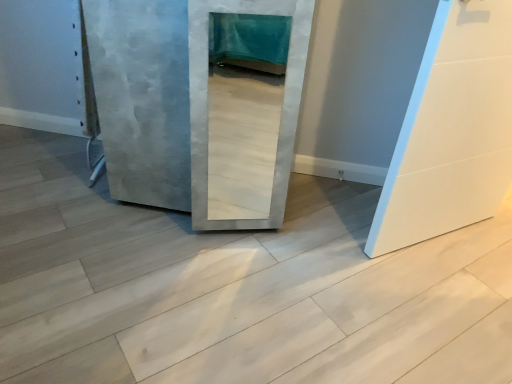
Question: Is white matte door at right, placed as the 1th door when sorted from right to left, bigger or smaller than concreteroughconcrete at center?

Choices:
 (A) small
 (B) big

Answer: (A)

Question: From a real-world perspective, is white matte door at right, placed as the 1th door when sorted from right to left, above or below concreteroughconcrete at center?

Choices:
 (A) below
 (B) above

Answer: (B)

Question: Which object is positioned farthest from the concreteroughconcrete at center?

Choices:
 (A) concrete textured door at center, which is the 2th door in right-to-left order
 (B) white matte door at right, the second door in the left-to-right sequence

Answer: (B)

Question: Which is nearer to the white matte door at right, the second door in the left-to-right sequence?

Choices:
 (A) concrete textured door at center, which is the 2th door in right-to-left order
 (B) concreteroughconcrete at center

Answer: (B)